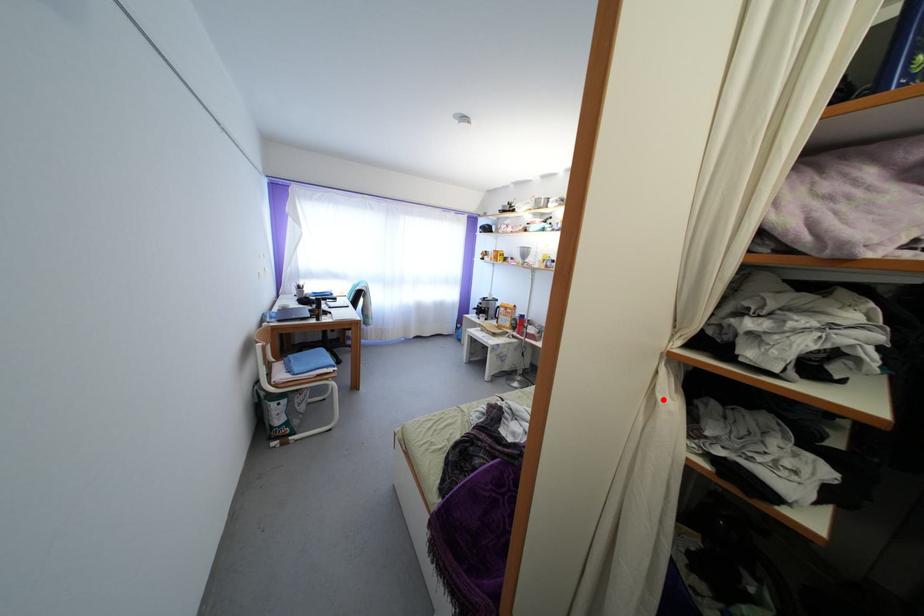
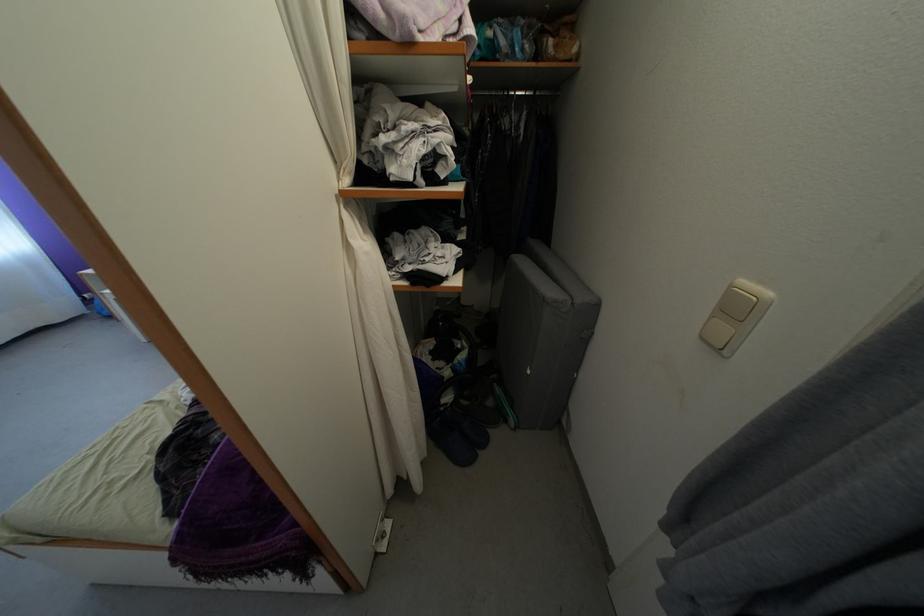
Locate, in the second image, the point that corresponds to the highlighted location in the first image.

(356, 246)